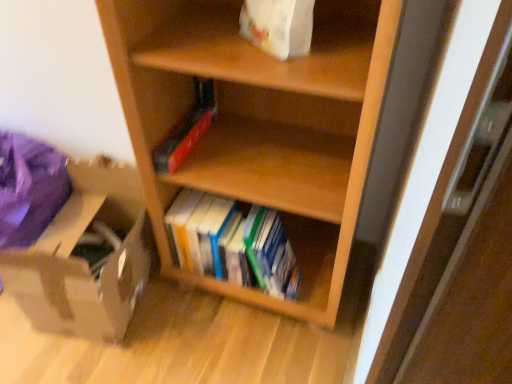
Question: In the image, is brown cardboard box at lower left on the left side or the right side of wooden shelf at center?

Choices:
 (A) right
 (B) left

Answer: (B)

Question: In terms of size, does brown cardboard box at lower left appear bigger or smaller than wooden shelf at center?

Choices:
 (A) big
 (B) small

Answer: (B)

Question: Estimate the real-world distances between objects in this image. Which object is closer to the hardcover books at center?

Choices:
 (A) white paper bag at upper center
 (B) brown cardboard box at lower left
 (C) wooden shelf at center

Answer: (C)

Question: Estimate the real-world distances between objects in this image. Which object is closer to the brown cardboard box at lower left?

Choices:
 (A) hardcover books at center
 (B) wooden shelf at center
 (C) white paper bag at upper center

Answer: (A)